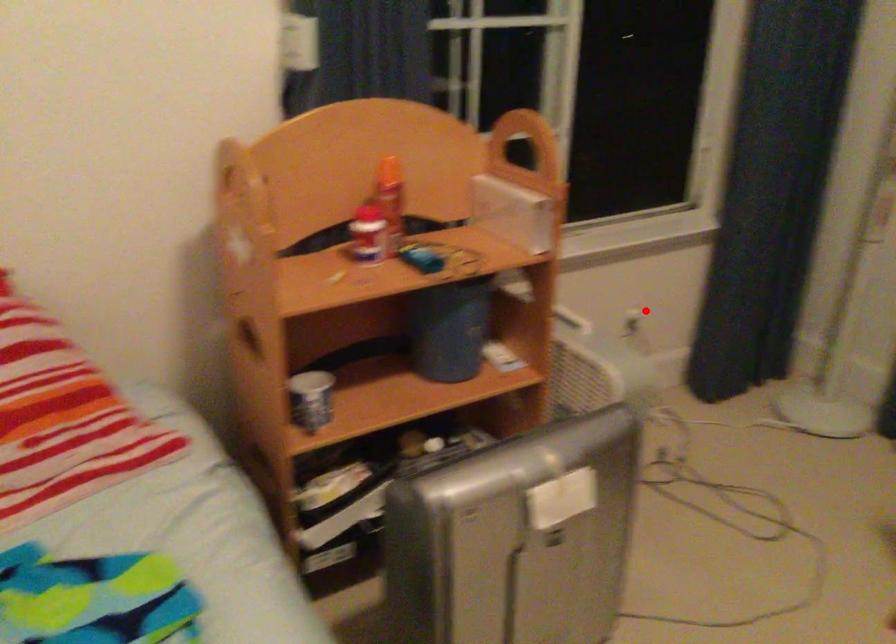
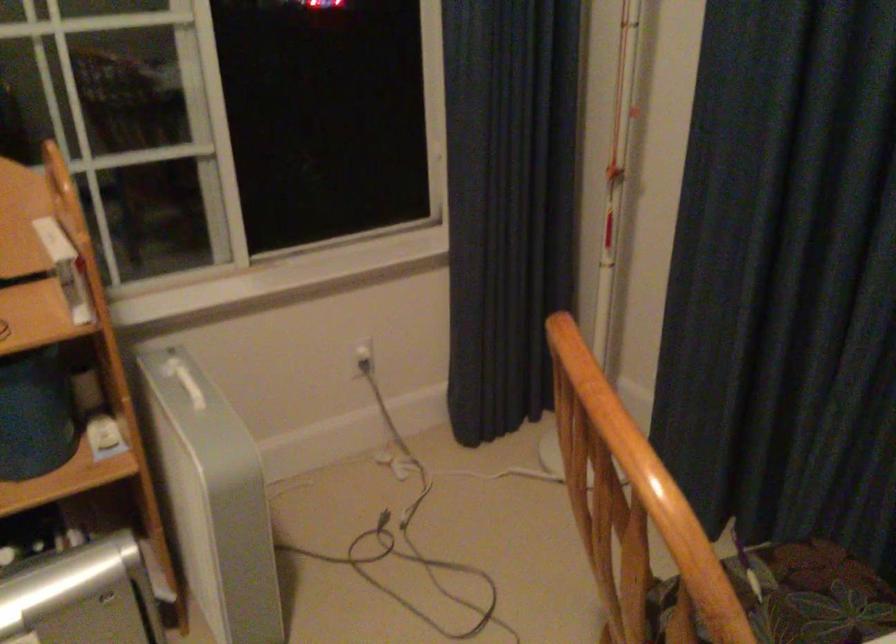
Where in the second image is the point corresponding to the highlighted location from the first image?

(363, 355)